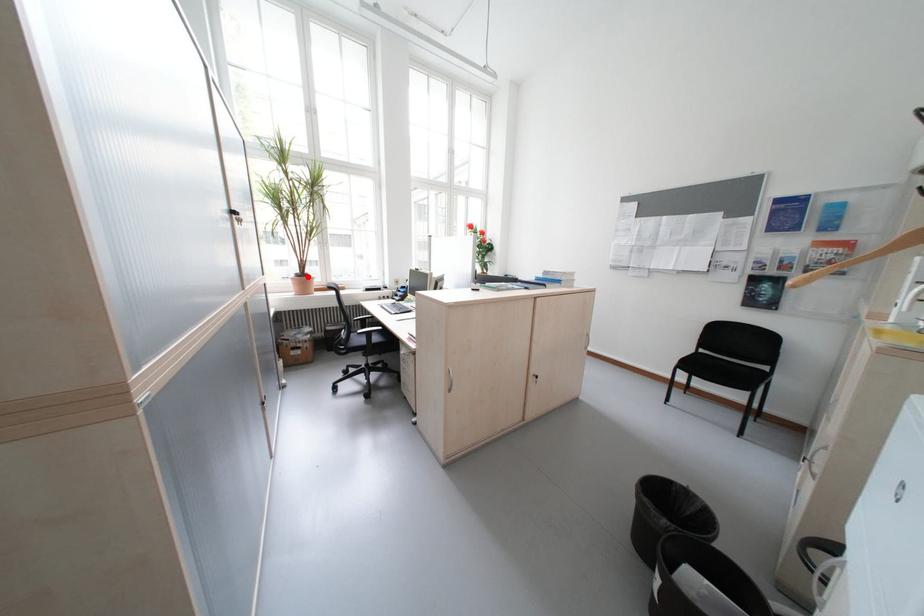
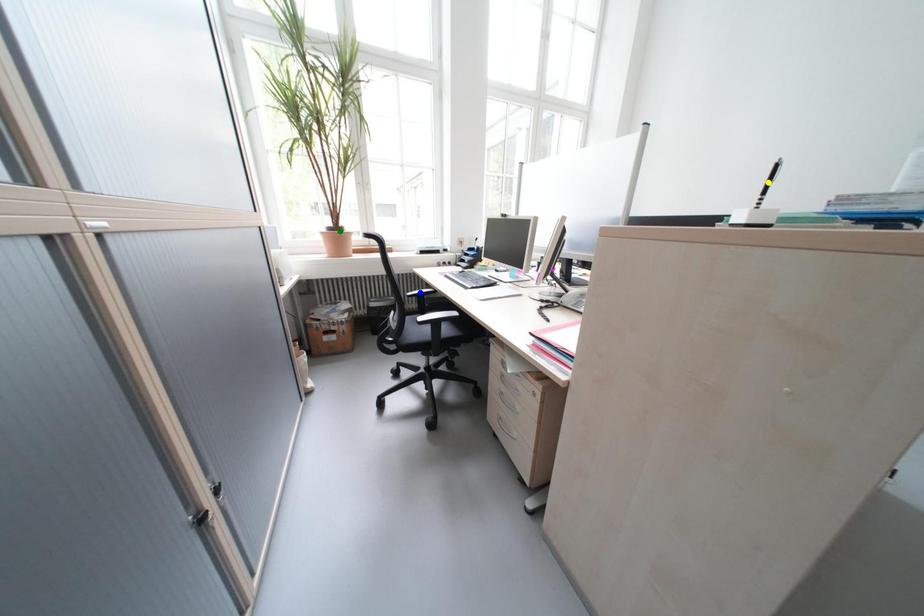
Question: I am providing you with two images of the same scene from different viewpoints. A red point is marked on the first image. You are given multiple points on the second image. Which spot in image 2 lines up with the point in image 1?

Choices:
 (A) yellow point
 (B) blue point
 (C) green point

Answer: (C)